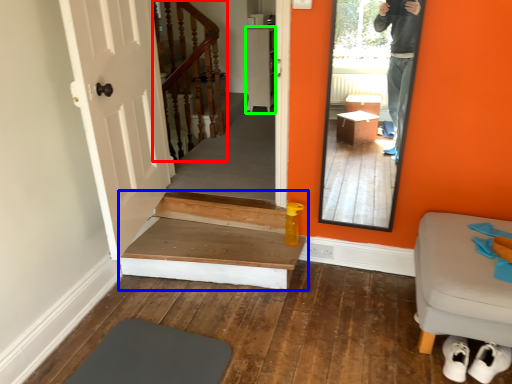
Question: Estimate the real-world distances between objects in this image. Which object is farther from stairs (highlighted by a red box), stairs (highlighted by a blue box) or cabinetry (highlighted by a green box)?

Choices:
 (A) stairs
 (B) cabinetry

Answer: (A)